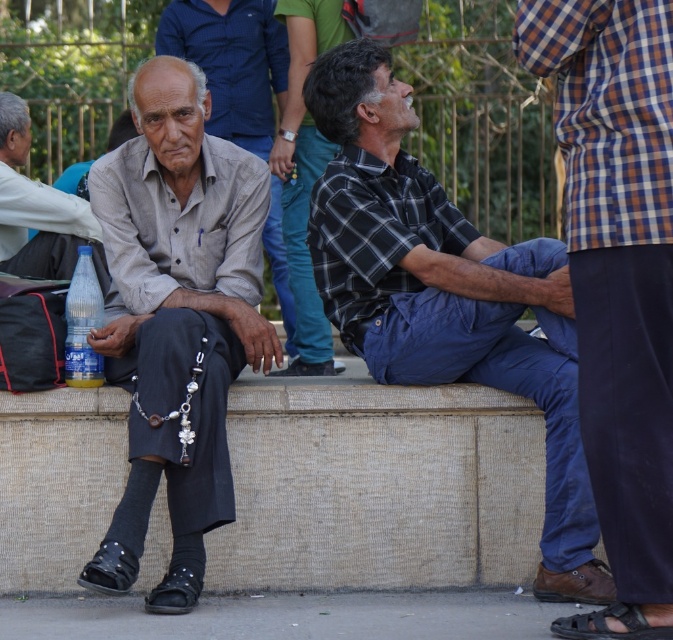
In the scene shown: Does light gray fabric shirt at left have a smaller size compared to black leather sandal at lower right?

Incorrect, light gray fabric shirt at left is not smaller in size than black leather sandal at lower right.

Measure the distance between point (225, 371) and camera.

Point (225, 371) and camera are 7.01 meters apart from each other.

Where is `light gray fabric shirt at left`? Image resolution: width=673 pixels, height=640 pixels. light gray fabric shirt at left is located at coordinates (176, 320).

Is light gray fabric shirt at left shorter than translucent plastic bottle at lower left?

No, light gray fabric shirt at left is not shorter than translucent plastic bottle at lower left.

Between light gray fabric shirt at left and translucent plastic bottle at lower left, which one has more height?

light gray fabric shirt at left

Between point (125, 310) and point (77, 337), which one is positioned behind?

Point (125, 310)

The height and width of the screenshot is (640, 673). I want to click on light gray fabric shirt at left, so click(176, 320).

Does checkered shirt at center appear over light gray fabric shirt at left?

Yes.

Can you confirm if checkered shirt at center is thinner than light gray fabric shirt at left?

No, checkered shirt at center is not thinner than light gray fabric shirt at left.

Describe the element at coordinates (446, 292) in the screenshot. I see `checkered shirt at center` at that location.

Locate an element on the screen. This screenshot has width=673, height=640. checkered shirt at center is located at coordinates (446, 292).